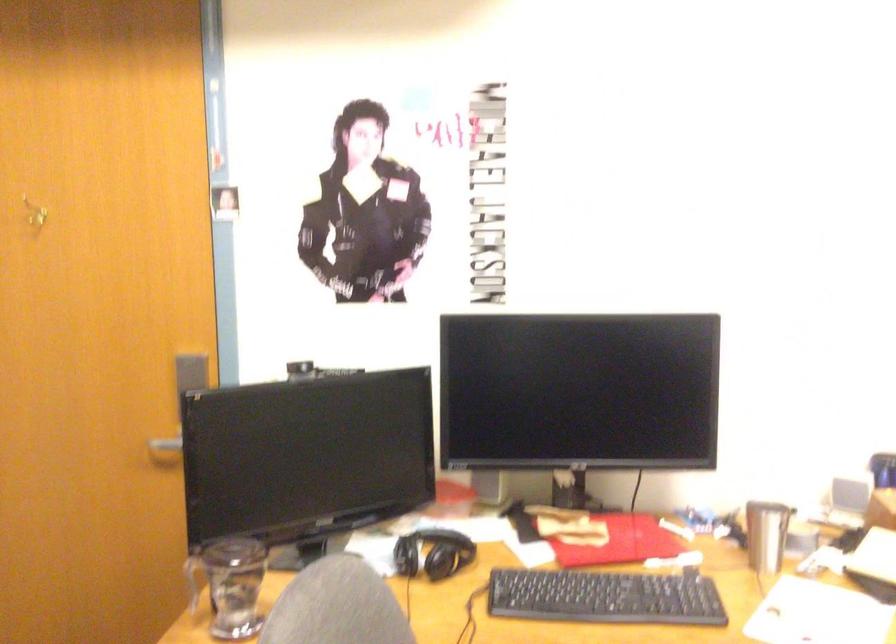
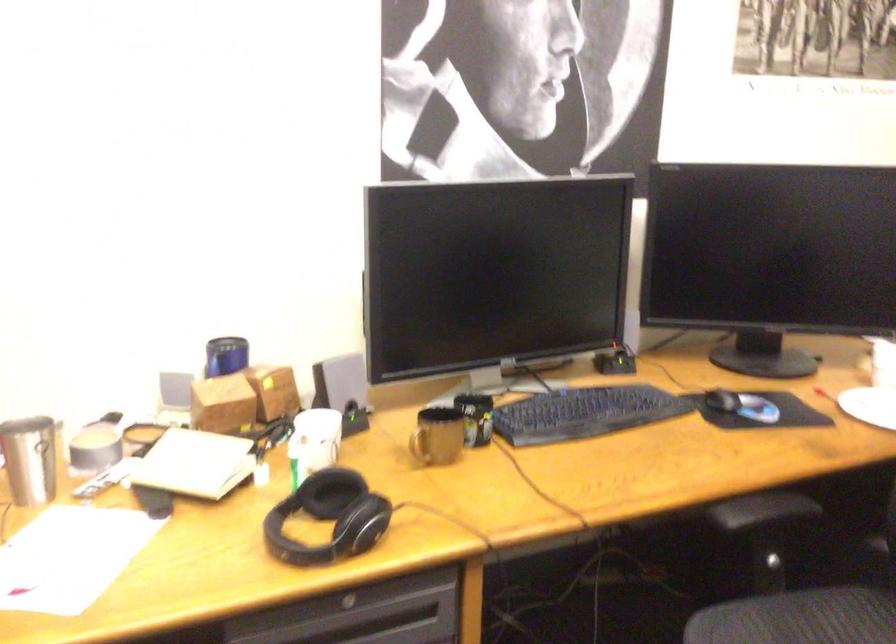
Locate, in the second image, the point that corresponds to (x=771, y=526) in the first image.

(30, 459)